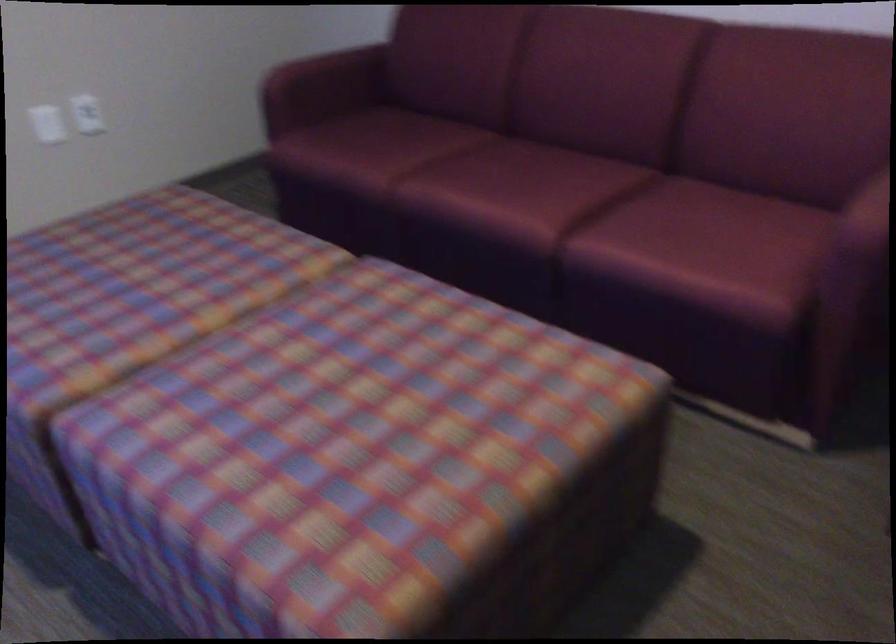
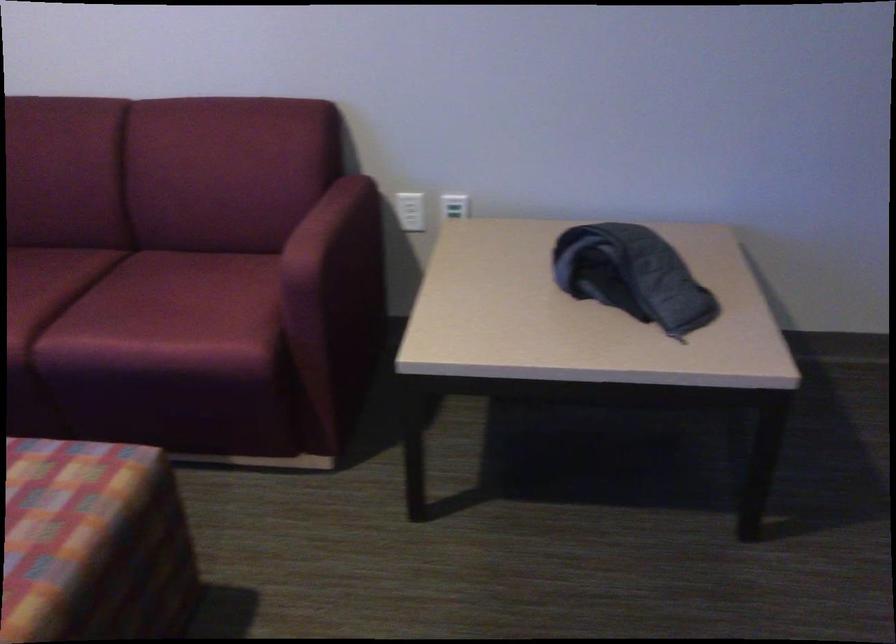
Find the pixel in the second image that matches the point at 701,223 in the first image.

(175, 290)